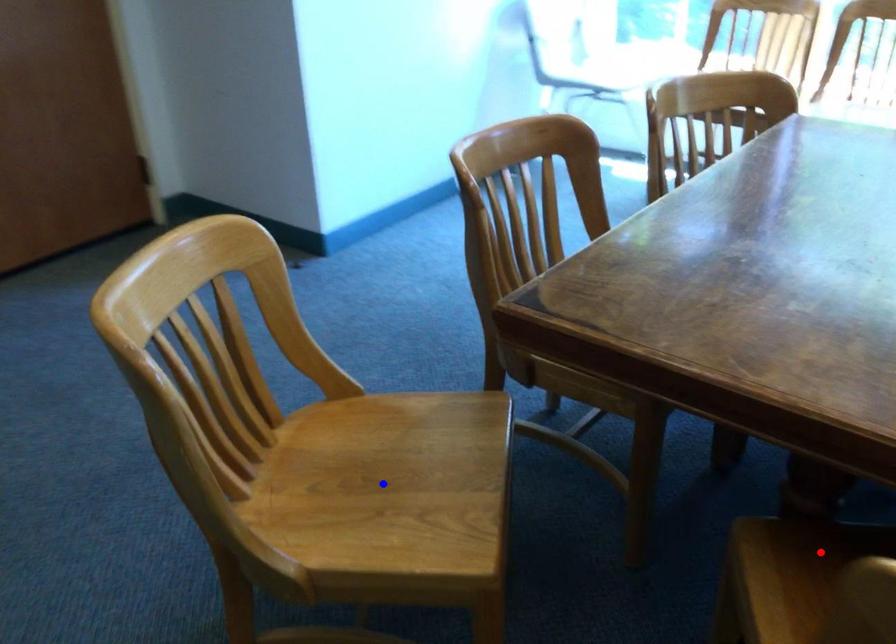
Question: In the image, two points are highlighted. Which point is nearer to the camera? Reply with the corresponding letter.

Choices:
 (A) blue point
 (B) red point

Answer: (B)